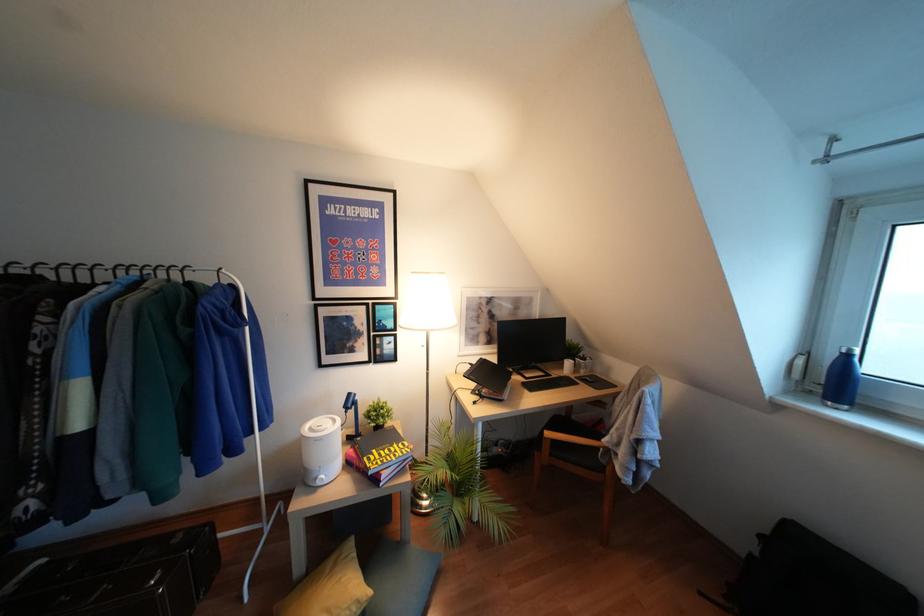
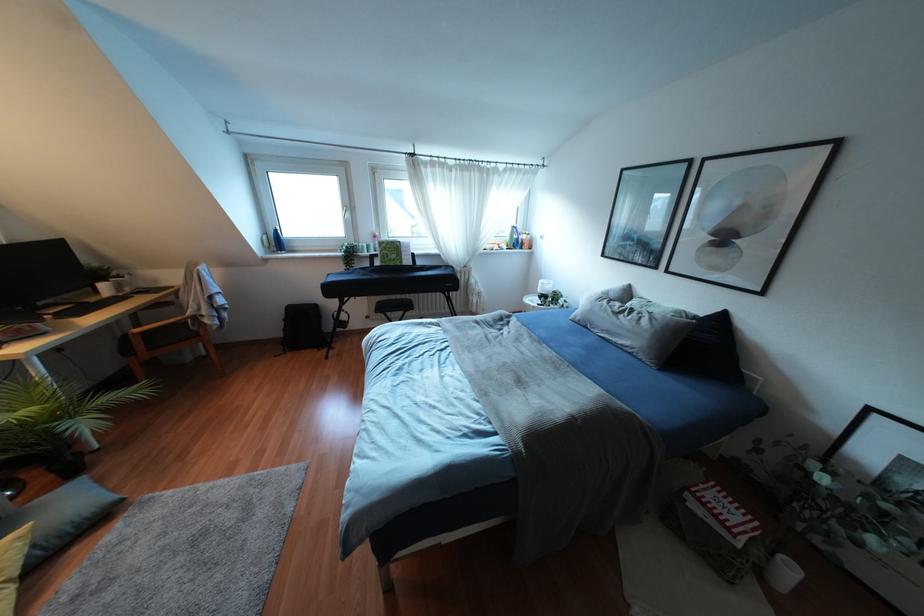
The point at (x=602, y=468) is marked in the first image. Where is the corresponding point in the second image?

(196, 334)